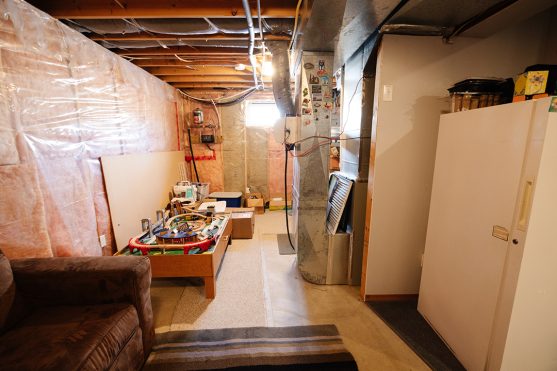
Identify the location of couch arm. (85, 263).